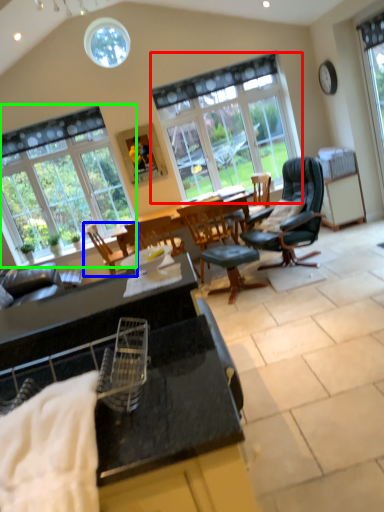
Question: Considering the real-world distances, which object is closest to window (highlighted by a red box)? chair (highlighted by a blue box) or window (highlighted by a green box).

Choices:
 (A) chair
 (B) window

Answer: (B)